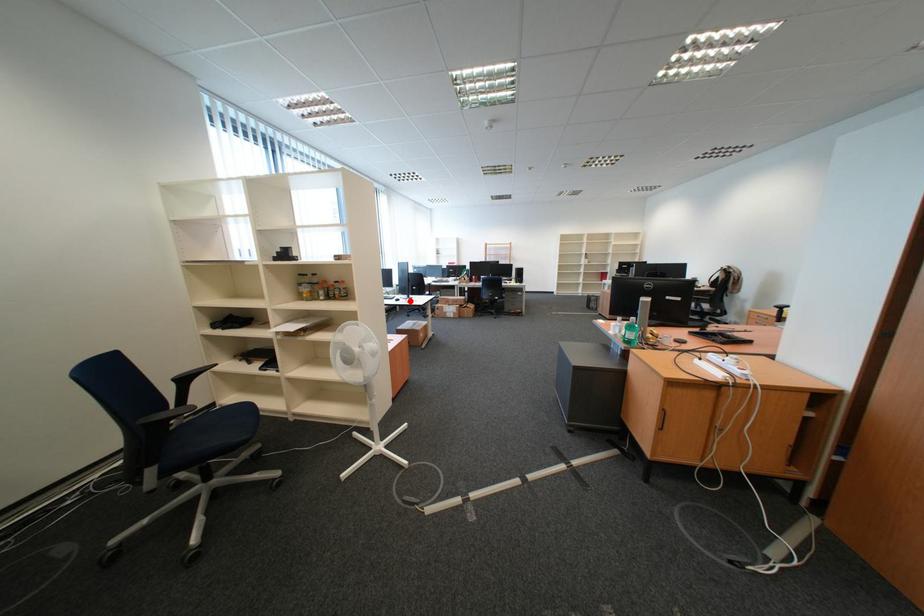
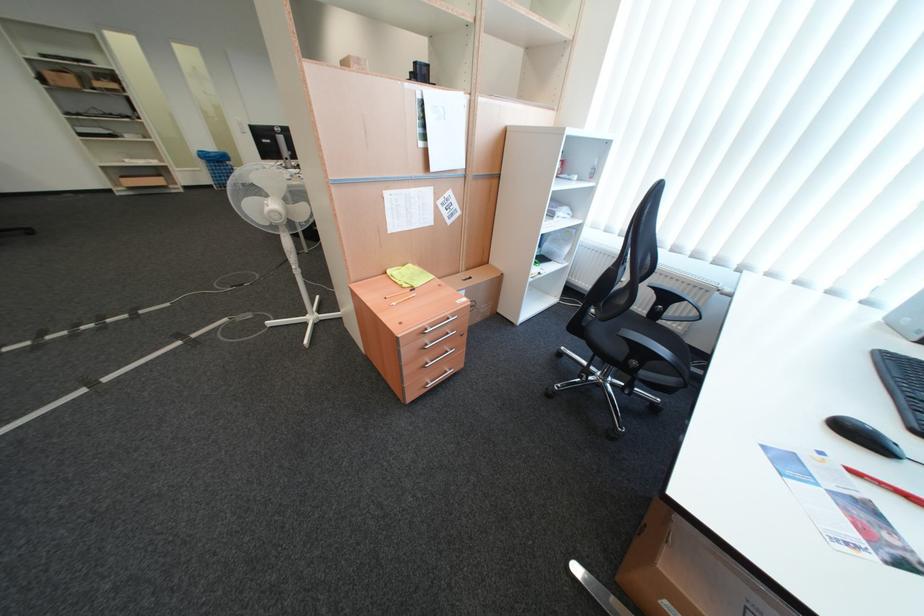
Find the pixel in the second image that matches the highlighted location in the first image.

(864, 434)